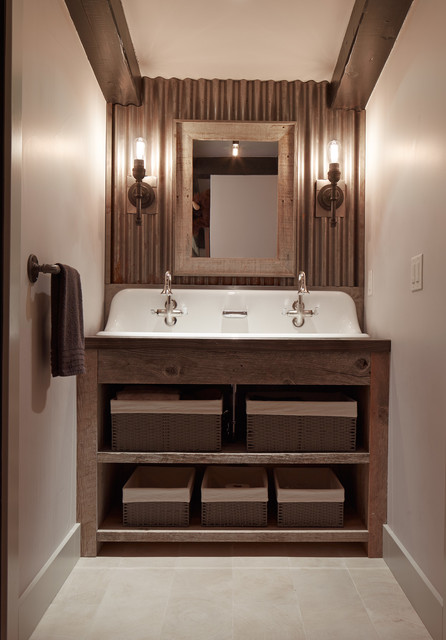
At what (x,y) coordinates should I click in order to perform the action: click on mirror frame. Please return your answer as a coordinate pair (x, y). Looking at the image, I should click on (238, 136), (233, 267), (176, 193), (289, 189).